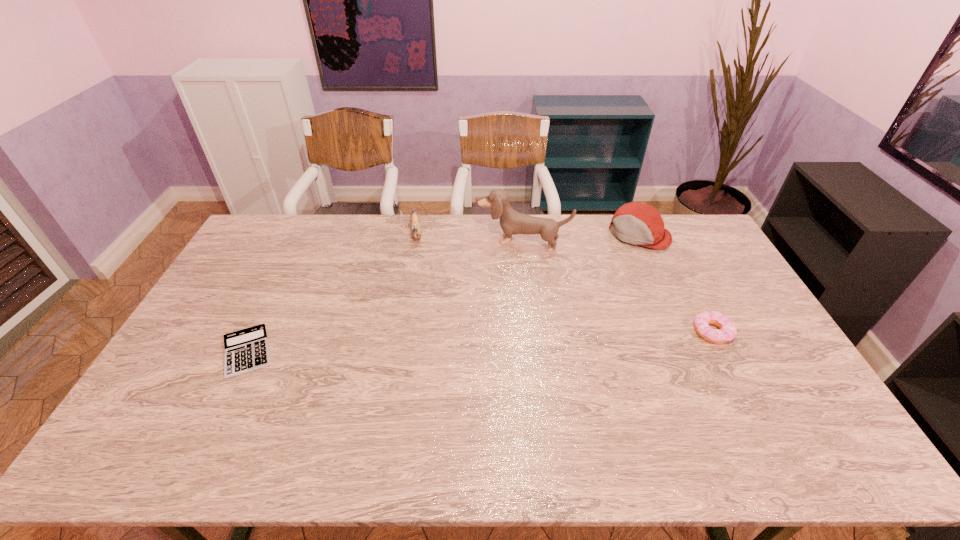
Point out which object is positioned as the second nearest to the cap. Please provide its 2D coordinates. Your answer should be formatted as a tuple, i.e. [(x, y)], where the tuple contains the x and y coordinates of a point satisfying the conditions above.

[(727, 331)]

The width and height of the screenshot is (960, 540). I want to click on object that is the closest to the banana, so [512, 222].

Identify the location of free spot that satisfies the following two spatial constraints: 1. on the front side of the cap; 2. on the left side of the doughnut. This screenshot has height=540, width=960. (683, 332).